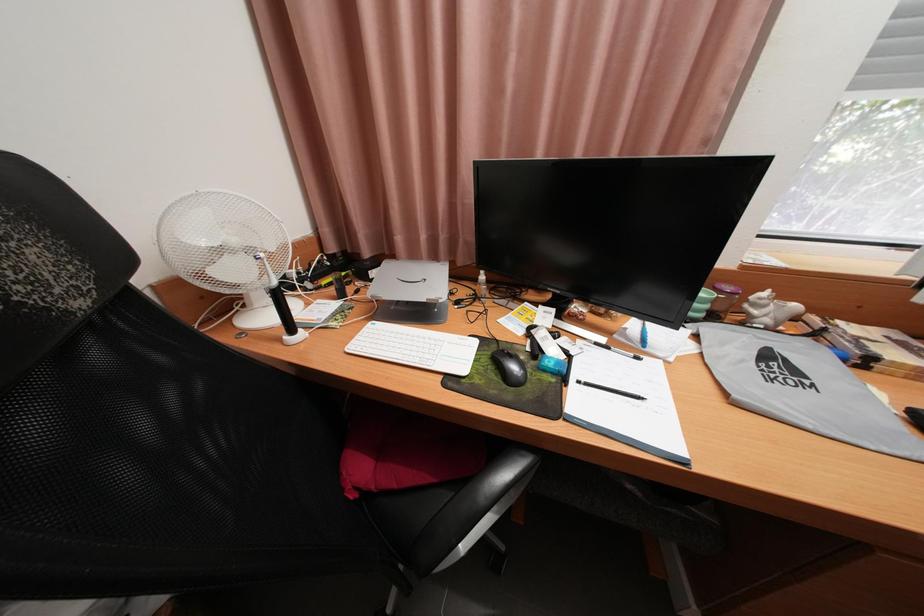
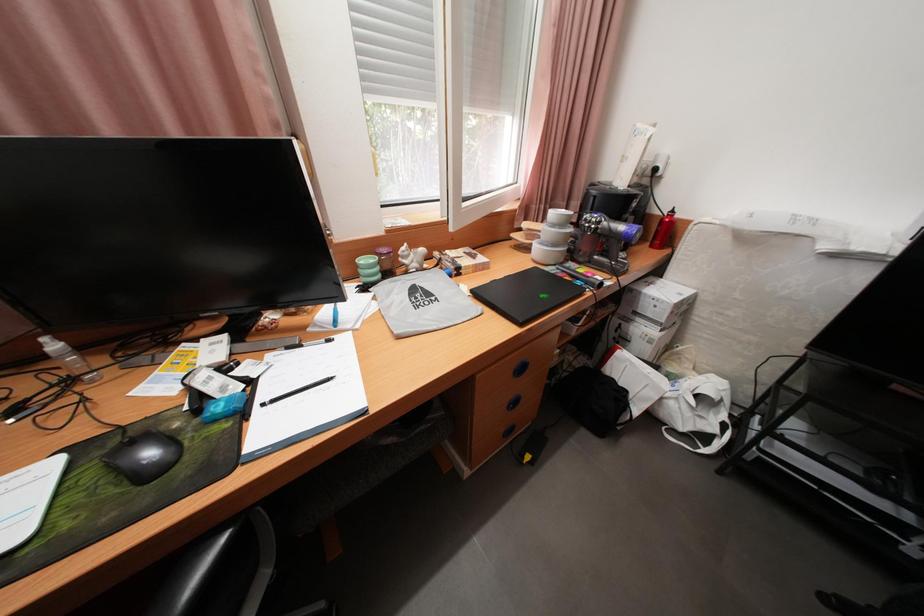
Question: The images are taken continuously from a first-person perspective. In which direction is your viewpoint rotating?

Choices:
 (A) Left
 (B) Right
 (C) Up
 (D) Down

Answer: (B)